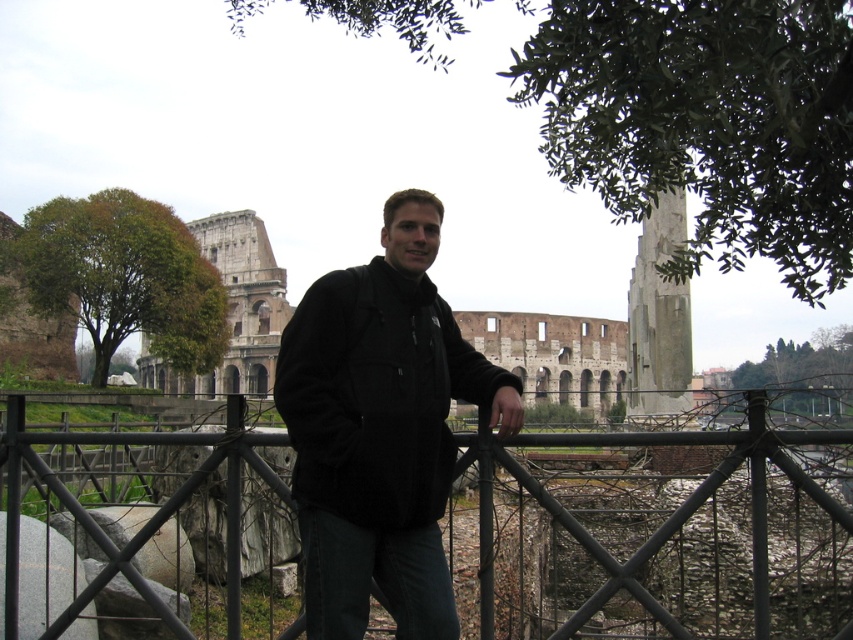
Question: Which of the following is the farthest from the observer?

Choices:
 (A) 311,483
 (B) 234,561

Answer: (B)

Question: Which point appears farthest from the camera in this image?

Choices:
 (A) (396, 272)
 (B) (234, 548)

Answer: (A)

Question: Can you confirm if black matte jacket at center is smaller than black metal fence at center?

Choices:
 (A) yes
 (B) no

Answer: (A)

Question: Which of the following is the closest to the observer?

Choices:
 (A) (544, 436)
 (B) (354, 532)

Answer: (B)

Question: Can you confirm if black matte jacket at center is positioned to the left of black metal fence at center?

Choices:
 (A) no
 (B) yes

Answer: (A)

Question: Does black matte jacket at center appear under black metal fence at center?

Choices:
 (A) yes
 (B) no

Answer: (B)